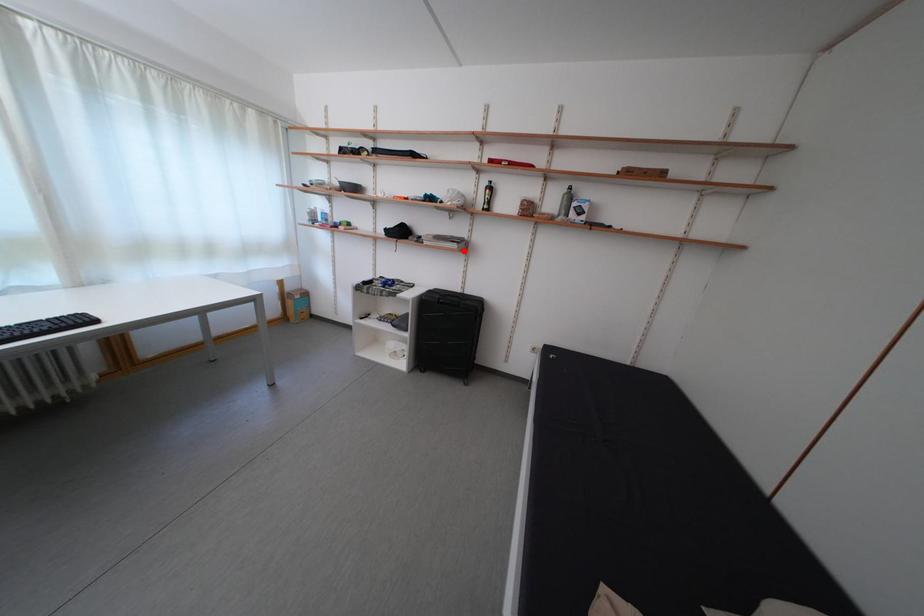
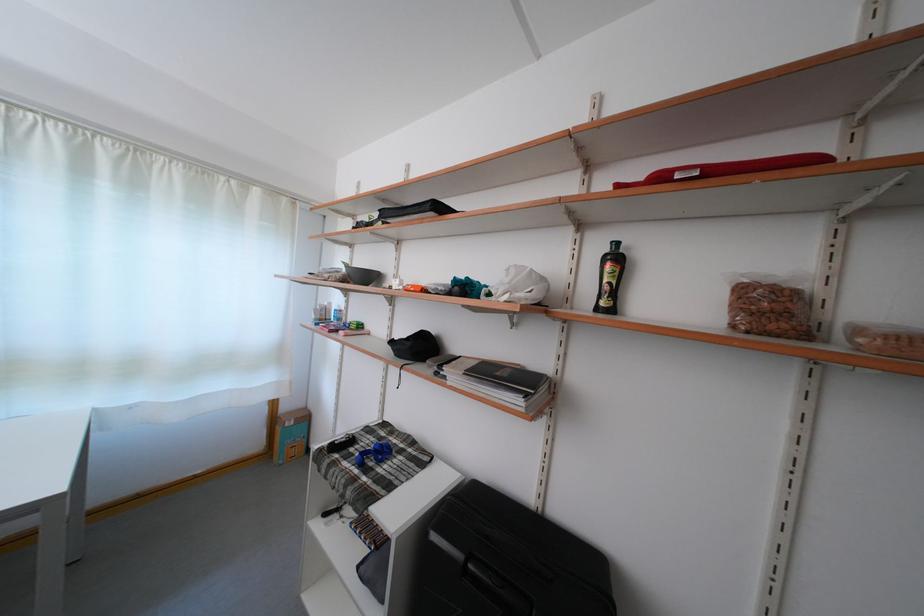
Question: I am providing you with two images of the same scene from different viewpoints. Given a red point in image1, look at the same physical point in image2. Is it:

Choices:
 (A) Closer to the viewpoint
 (B) Farther from the viewpoint

Answer: (B)